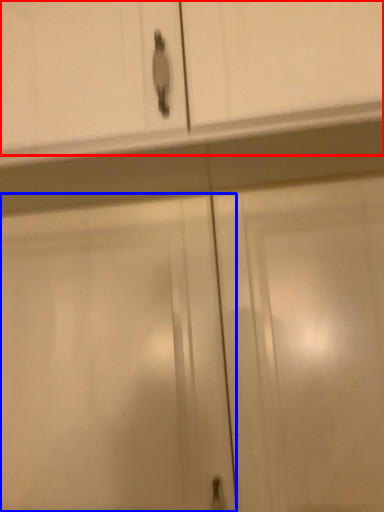
Question: Among these objects, which one is nearest to the camera, cabinetry (highlighted by a red box) or screen door (highlighted by a blue box)?

Choices:
 (A) cabinetry
 (B) screen door

Answer: (A)